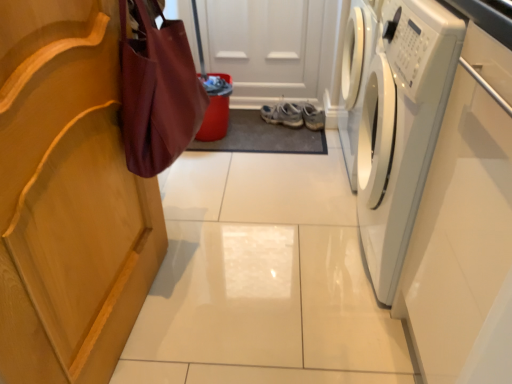
Question: Considering the relative sizes of light blue fabric sneakers at center and burgundy fabric bag at left in the image provided, is light blue fabric sneakers at center wider than burgundy fabric bag at left?

Choices:
 (A) yes
 (B) no

Answer: (A)

Question: From a real-world perspective, is light blue fabric sneakers at center under burgundy fabric bag at left?

Choices:
 (A) no
 (B) yes

Answer: (B)

Question: Is light blue fabric sneakers at center behind burgundy fabric bag at left?

Choices:
 (A) no
 (B) yes

Answer: (B)

Question: From the image's perspective, is light blue fabric sneakers at center located beneath burgundy fabric bag at left?

Choices:
 (A) yes
 (B) no

Answer: (B)

Question: Is light blue fabric sneakers at center bigger than burgundy fabric bag at left?

Choices:
 (A) no
 (B) yes

Answer: (A)

Question: Does light blue fabric sneakers at center have a lesser width compared to burgundy fabric bag at left?

Choices:
 (A) yes
 (B) no

Answer: (B)

Question: Is light blue fabric sneakers at center facing away from white glossy washing machine at right?

Choices:
 (A) no
 (B) yes

Answer: (A)

Question: Can you confirm if light blue fabric sneakers at center is positioned to the right of white glossy washing machine at right?

Choices:
 (A) yes
 (B) no

Answer: (B)

Question: Is light blue fabric sneakers at center in front of white glossy washing machine at right?

Choices:
 (A) no
 (B) yes

Answer: (A)

Question: Is white glossy washing machine at right surrounded by light blue fabric sneakers at center?

Choices:
 (A) no
 (B) yes

Answer: (A)

Question: Could you tell me if light blue fabric sneakers at center is turned towards white glossy washing machine at right?

Choices:
 (A) yes
 (B) no

Answer: (A)

Question: Is light blue fabric sneakers at center wider than white glossy washing machine at right?

Choices:
 (A) yes
 (B) no

Answer: (B)

Question: Can you confirm if burgundy fabric bag at left is thinner than white glossy washing machine at right?

Choices:
 (A) no
 (B) yes

Answer: (B)